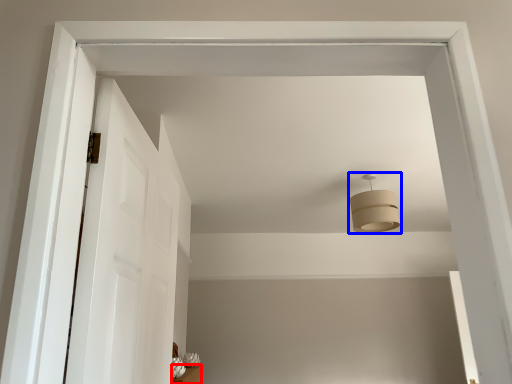
Question: Which object appears farthest to the camera in this image, furniture (highlighted by a red box) or fixture (highlighted by a blue box)?

Choices:
 (A) furniture
 (B) fixture

Answer: (B)